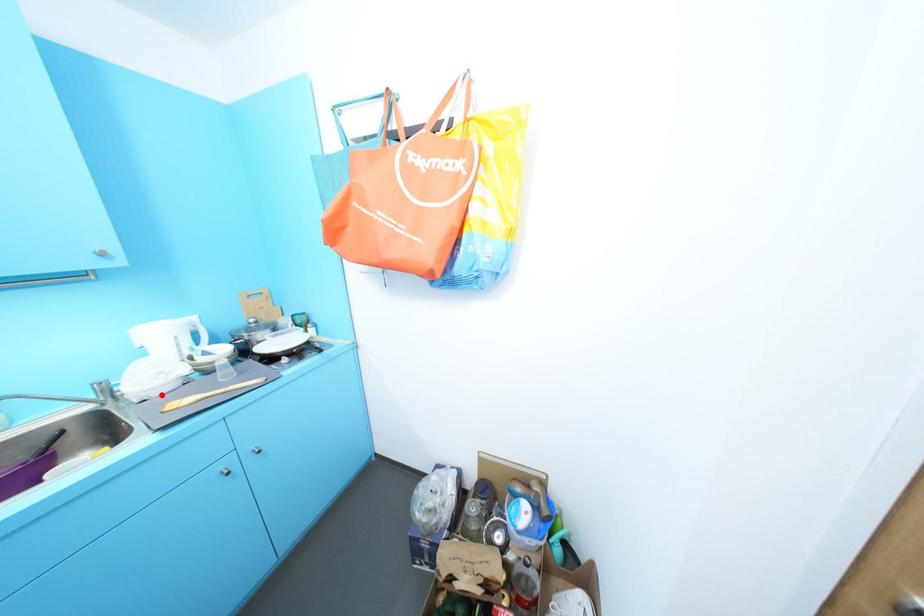
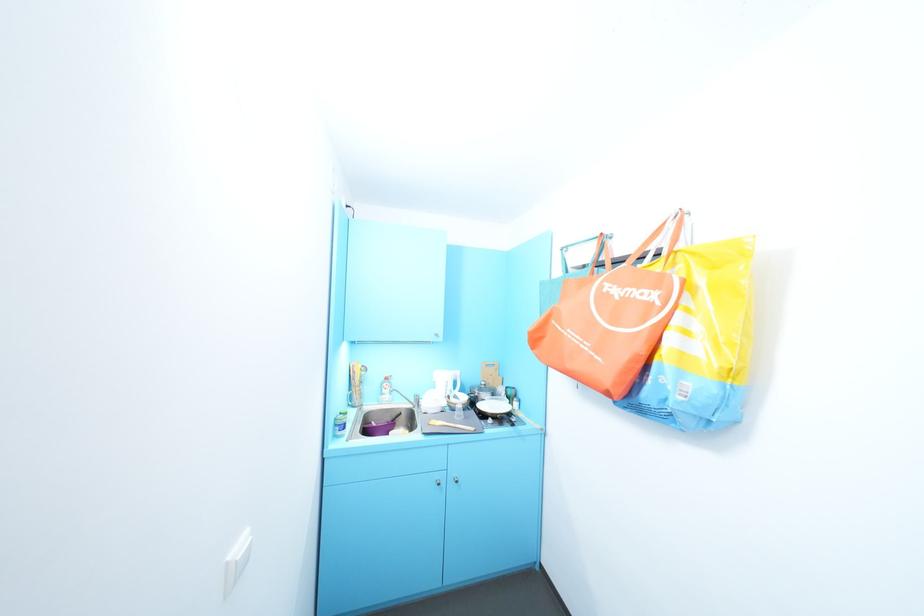
The point at the highlighted location is marked in the first image. Where is the corresponding point in the second image?

(436, 411)